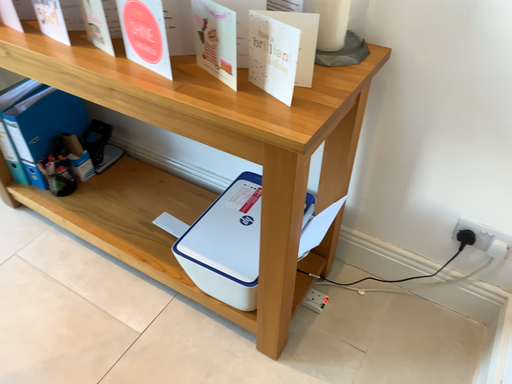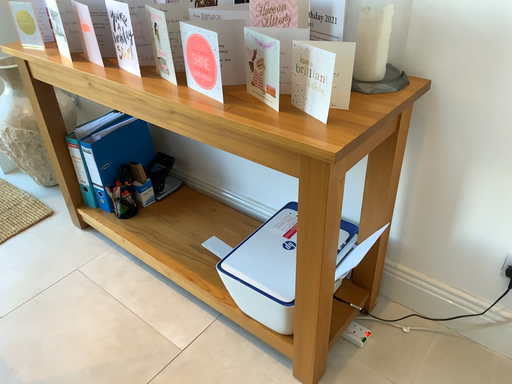
Question: How did the camera likely rotate when shooting the video?

Choices:
 (A) rotated upward
 (B) rotated downward

Answer: (A)